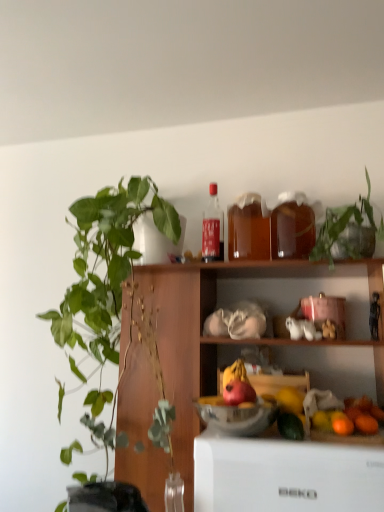
Question: Would you say orange matte at lower right contains red matte apple at center?

Choices:
 (A) yes
 (B) no

Answer: (B)

Question: Can you confirm if orange matte at lower right is bigger than red matte apple at center?

Choices:
 (A) yes
 (B) no

Answer: (B)

Question: Is orange matte at lower right far away from red matte apple at center?

Choices:
 (A) no
 (B) yes

Answer: (A)

Question: From the image's perspective, is orange matte at lower right beneath red matte apple at center?

Choices:
 (A) no
 (B) yes

Answer: (B)

Question: Is orange matte at lower right looking in the opposite direction of red matte apple at center?

Choices:
 (A) no
 (B) yes

Answer: (A)

Question: Is orange matte at lower right smaller than red matte apple at center?

Choices:
 (A) no
 (B) yes

Answer: (B)

Question: Does metallic silver bowl at center have a greater width compared to matte glass bottle at upper center, arranged as the 3th bottle when viewed from the right?

Choices:
 (A) yes
 (B) no

Answer: (A)

Question: Is metallic silver bowl at center located outside matte glass bottle at upper center, positioned as the first bottle in left-to-right order?

Choices:
 (A) no
 (B) yes

Answer: (B)

Question: Considering the relative sizes of metallic silver bowl at center and matte glass bottle at upper center, positioned as the first bottle in left-to-right order, in the image provided, is metallic silver bowl at center shorter than matte glass bottle at upper center, positioned as the first bottle in left-to-right order,?

Choices:
 (A) yes
 (B) no

Answer: (A)

Question: Could you tell me if metallic silver bowl at center is facing matte glass bottle at upper center, positioned as the first bottle in left-to-right order?

Choices:
 (A) no
 (B) yes

Answer: (A)

Question: Is metallic silver bowl at center bigger than matte glass bottle at upper center, positioned as the first bottle in left-to-right order?

Choices:
 (A) yes
 (B) no

Answer: (A)

Question: Is metallic silver bowl at center surrounding matte glass bottle at upper center, positioned as the first bottle in left-to-right order?

Choices:
 (A) no
 (B) yes

Answer: (A)

Question: From the image's perspective, is green leafy plant at upper right, which appears as the 2th houseplant when viewed from the left, below red matte apple at center?

Choices:
 (A) no
 (B) yes

Answer: (A)